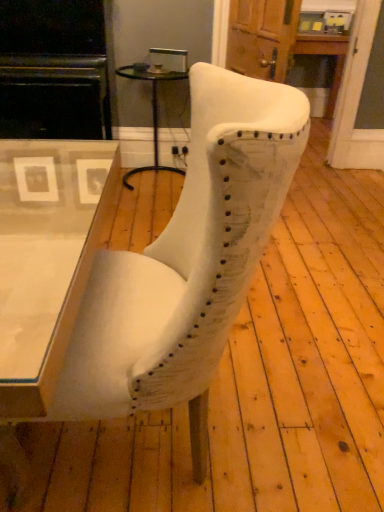
What do you see at coordinates (53, 69) in the screenshot?
I see `matte black entertainment center at left` at bounding box center [53, 69].

Locate an element on the screen. The image size is (384, 512). black glass side table at center is located at coordinates (152, 110).

This screenshot has width=384, height=512. I want to click on matte black entertainment center at left, so click(53, 69).

From a real-world perspective, which object rests below the other?

black glass side table at center is physically lower.

Which object is closer to the camera, black glass side table at center or white fabric chair at center?

white fabric chair at center is more forward.

Could you tell me if black glass side table at center is facing white fabric chair at center?

Yes, black glass side table at center is aimed at white fabric chair at center.

Can you confirm if black glass side table at center is taller than white fabric chair at center?

No, black glass side table at center is not taller than white fabric chair at center.

How many degrees apart are the facing directions of black glass side table at center and matte black entertainment center at left?

0.947 degrees separate the facing orientations of black glass side table at center and matte black entertainment center at left.

Is black glass side table at center shorter than matte black entertainment center at left?

Correct, black glass side table at center is not as tall as matte black entertainment center at left.

Are black glass side table at center and matte black entertainment center at left beside each other?

They are not placed beside each other.

The width and height of the screenshot is (384, 512). In order to click on side table located behind the matte black entertainment center at left in this screenshot , I will do `click(152, 110)`.

Which is more to the right, matte black entertainment center at left or black glass side table at center?

black glass side table at center.

Does matte black entertainment center at left turn towards black glass side table at center?

No, matte black entertainment center at left is not aimed at black glass side table at center.

Which object is closer to the camera, matte black entertainment center at left or black glass side table at center?

matte black entertainment center at left is in front.

From a real-world perspective, who is located lower, matte black entertainment center at left or black glass side table at center?

black glass side table at center.

Choose the correct answer: Is matte black entertainment center at left inside white fabric chair at center or outside it?

matte black entertainment center at left is outside white fabric chair at center.

From the image's perspective, relative to white fabric chair at center, is matte black entertainment center at left above or below?

Based on their image positions, matte black entertainment center at left is located above white fabric chair at center.

Is matte black entertainment center at left facing away from white fabric chair at center?

matte black entertainment center at left is not turned away from white fabric chair at center.

The height and width of the screenshot is (512, 384). What are the coordinates of `entertainment center above the white fabric chair at center (from a real-world perspective)` in the screenshot? It's located at (53, 69).

Does white fabric chair at center appear on the left side of black glass side table at center?

Incorrect, white fabric chair at center is not on the left side of black glass side table at center.

Looking at this image, from a real-world perspective, is white fabric chair at center positioned above or below black glass side table at center?

white fabric chair at center is above black glass side table at center.

Is white fabric chair at center directly adjacent to black glass side table at center?

white fabric chair at center and black glass side table at center are not in contact.

Is white fabric chair at center looking in the opposite direction of black glass side table at center?

No, black glass side table at center is not at the back of white fabric chair at center.

Is the position of white fabric chair at center more distant than that of matte black entertainment center at left?

No, white fabric chair at center is closer to the viewer.

From the picture: Considering the sizes of objects white fabric chair at center and matte black entertainment center at left in the image provided, who is smaller, white fabric chair at center or matte black entertainment center at left?

Smaller between the two is white fabric chair at center.

How far apart are white fabric chair at center and matte black entertainment center at left?

The distance of white fabric chair at center from matte black entertainment center at left is 1.92 meters.

At what (x,y) coordinates should I click in order to perform the action: click on entertainment center that is above the white fabric chair at center (from a real-world perspective). Please return your answer as a coordinate pair (x, y). This screenshot has width=384, height=512. Looking at the image, I should click on (53, 69).

At what (x,y) coordinates should I click in order to perform the action: click on side table behind the white fabric chair at center. Please return your answer as a coordinate pair (x, y). Looking at the image, I should click on (152, 110).

I want to click on side table lying on the right of matte black entertainment center at left, so click(x=152, y=110).

Estimate the real-world distances between objects in this image. Which object is closer to matte black entertainment center at left, white fabric chair at center or black glass side table at center?

Based on the image, black glass side table at center appears to be nearer to matte black entertainment center at left.

Considering their positions, is matte black entertainment center at left positioned further to white fabric chair at center than black glass side table at center?

The object further to white fabric chair at center is black glass side table at center.

Looking at this image, looking at the image, which one is located further to black glass side table at center, matte black entertainment center at left or white fabric chair at center?

white fabric chair at center is further to black glass side table at center.

From the image, which object appears to be nearer to matte black entertainment center at left, black glass side table at center or white fabric chair at center?

The object closer to matte black entertainment center at left is black glass side table at center.

From the image, which object appears to be farther from white fabric chair at center, black glass side table at center or matte black entertainment center at left?

black glass side table at center lies further to white fabric chair at center than the other object.

Looking at the image, which one is located closer to black glass side table at center, white fabric chair at center or matte black entertainment center at left?

Based on the image, matte black entertainment center at left appears to be nearer to black glass side table at center.

Locate an element on the screen. entertainment center located between white fabric chair at center and black glass side table at center in the depth direction is located at coordinates (53, 69).